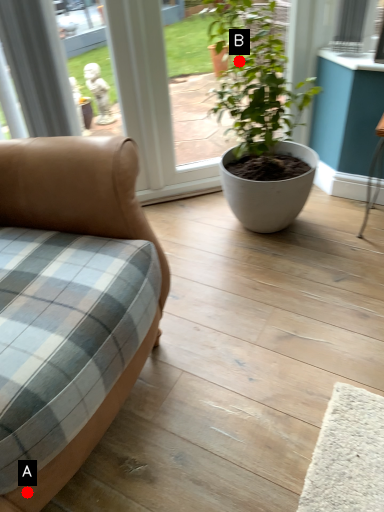
Question: Two points are circled on the image, labeled by A and B beside each circle. Which of the following is the farthest from the observer?

Choices:
 (A) A is further
 (B) B is further

Answer: (B)